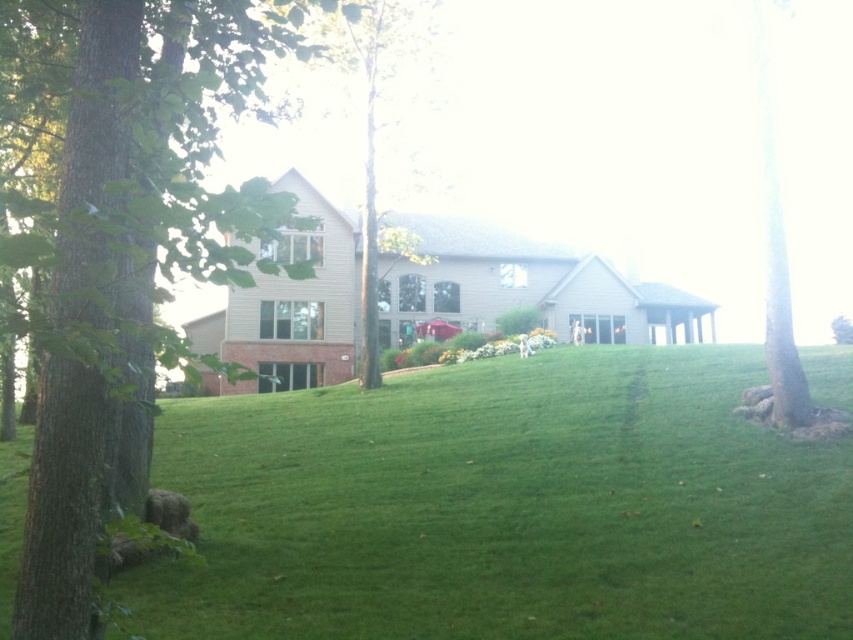
Question: Does brown rough bark tree at right appear on the left side of green leafy tree at right?

Choices:
 (A) no
 (B) yes

Answer: (B)

Question: Estimate the real-world distances between objects in this image. Which object is closer to the brown rough bark tree at right?

Choices:
 (A) brown rough tree at left
 (B) green leafy tree at right
 (C) green leafy tree at center

Answer: (A)

Question: Which point is farther to the camera?

Choices:
 (A) (134, 80)
 (B) (833, 324)
 (C) (778, 236)
 (D) (402, 80)

Answer: (D)

Question: Does brown rough tree at left have a lesser width compared to green leafy tree at right?

Choices:
 (A) yes
 (B) no

Answer: (B)

Question: Does brown rough tree at left appear on the right side of green leafy tree at right?

Choices:
 (A) yes
 (B) no

Answer: (B)

Question: Which point appears closest to the camera in this image?

Choices:
 (A) (303, 1)
 (B) (764, 209)

Answer: (A)